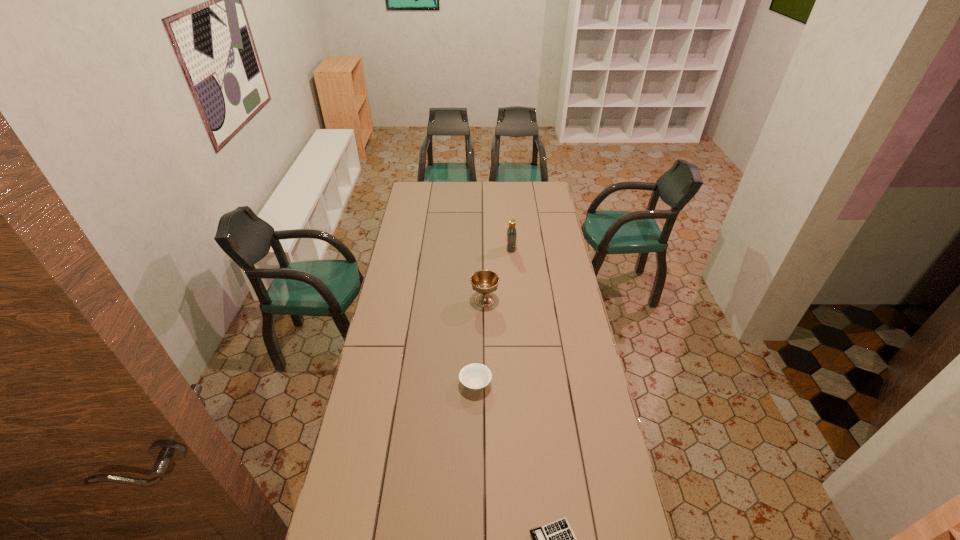
This screenshot has width=960, height=540. Identify the location of blank space located 0.060m on the front of the third tallest object. (475, 411).

The image size is (960, 540). I want to click on vacant space at the far edge of the desktop, so click(x=495, y=190).

This screenshot has height=540, width=960. I want to click on vacant space at the left edge of the desktop, so click(394, 290).

In the image, there is a desktop. Where is `vacant space at the right edge`? vacant space at the right edge is located at coordinates (589, 393).

At what (x,y) coordinates should I click in order to perform the action: click on free region at the far right corner of the desktop. Please return your answer as a coordinate pair (x, y). Looking at the image, I should click on (540, 197).

I want to click on free space that is in between the second farthest object and the bowl, so click(x=480, y=342).

At what (x,y) coordinates should I click in order to perform the action: click on free space that is in between the third nearest object and the second shortest object. Please return your answer as a coordinate pair (x, y). Looking at the image, I should click on (480, 342).

Locate an element on the screen. This screenshot has width=960, height=540. free spot between the third nearest object and the second nearest object is located at coordinates (480, 342).

Where is `object that is the closest to the chalice`? The width and height of the screenshot is (960, 540). object that is the closest to the chalice is located at coordinates (511, 231).

Identify which object is located as the nearest to the bowl. Please provide its 2D coordinates. Your answer should be formatted as a tuple, i.e. [(x, y)], where the tuple contains the x and y coordinates of a point satisfying the conditions above.

[(484, 282)]